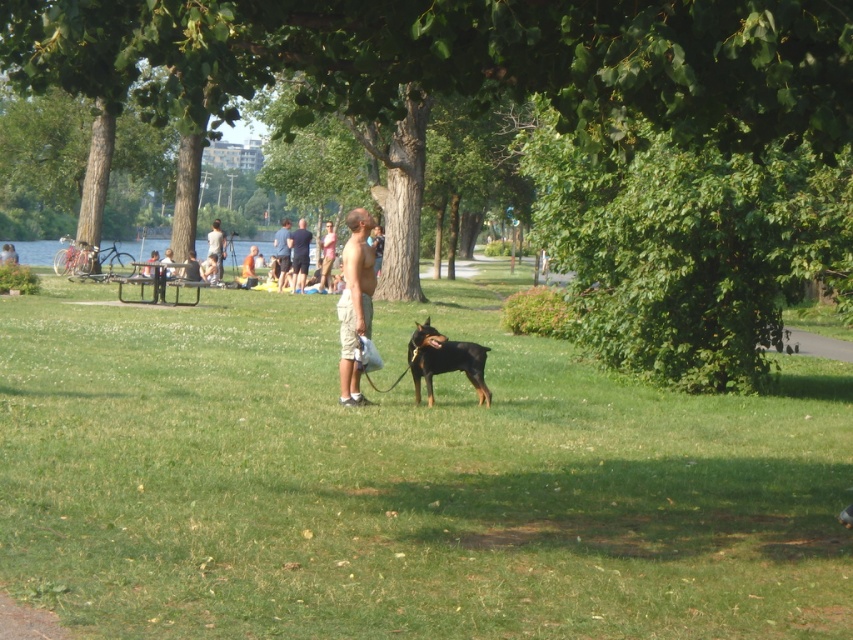
Question: Which point is closer to the camera?

Choices:
 (A) (283, 282)
 (B) (445, 355)
 (C) (341, 376)

Answer: (C)

Question: Is green leafy tree at center wider than dark blue shirt at center?

Choices:
 (A) yes
 (B) no

Answer: (A)

Question: Which is farther from the dark blue shirt at center?

Choices:
 (A) smooth tan shorts at center
 (B) green leafy tree at center
 (C) black smooth doberman at center
 (D) smooth blue shirt at center

Answer: (C)

Question: Which object appears closest to the camera in this image?

Choices:
 (A) smooth blue shirt at center
 (B) smooth skin man at center
 (C) black smooth doberman at center
 (D) green grass at center

Answer: (D)

Question: Is dark blue shirt at center thinner than smooth blue shirt at center?

Choices:
 (A) no
 (B) yes

Answer: (B)

Question: Can you confirm if green grass at center is bigger than dark blue shirt at center?

Choices:
 (A) yes
 (B) no

Answer: (A)